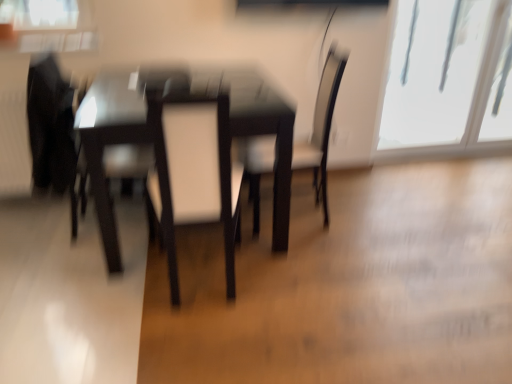
Locate an element on the screen. free space in front of glossy dark wood table at center is located at coordinates (180, 322).